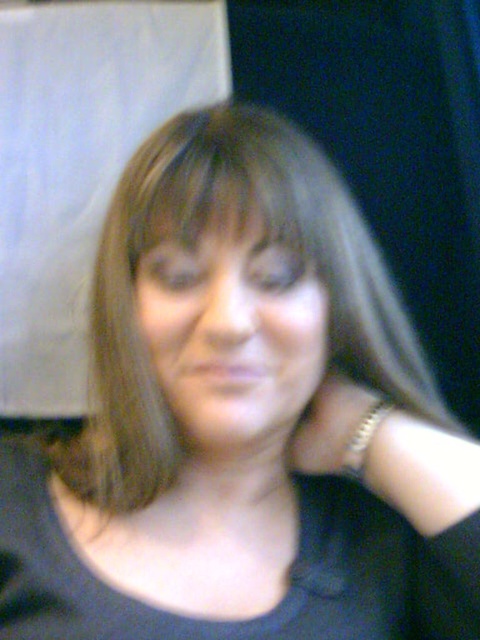
Question: Does smooth skin face at center have a larger size compared to gold metallic bracelet at right?

Choices:
 (A) no
 (B) yes

Answer: (B)

Question: Can you confirm if smooth skin face at center is wider than gold metallic bracelet at right?

Choices:
 (A) yes
 (B) no

Answer: (A)

Question: Which object is the farthest from the gold metallic bracelet at right?

Choices:
 (A) smooth skin face at center
 (B) gold metallic bracelet at neck

Answer: (A)

Question: Where is smooth skin face at center located in relation to gold metallic bracelet at right in the image?

Choices:
 (A) right
 (B) left

Answer: (B)

Question: Which point appears closest to the camera in this image?

Choices:
 (A) (326, 376)
 (B) (237, 300)

Answer: (B)

Question: Which point is closer to the camera?

Choices:
 (A) pyautogui.click(x=322, y=449)
 (B) pyautogui.click(x=220, y=381)

Answer: (B)